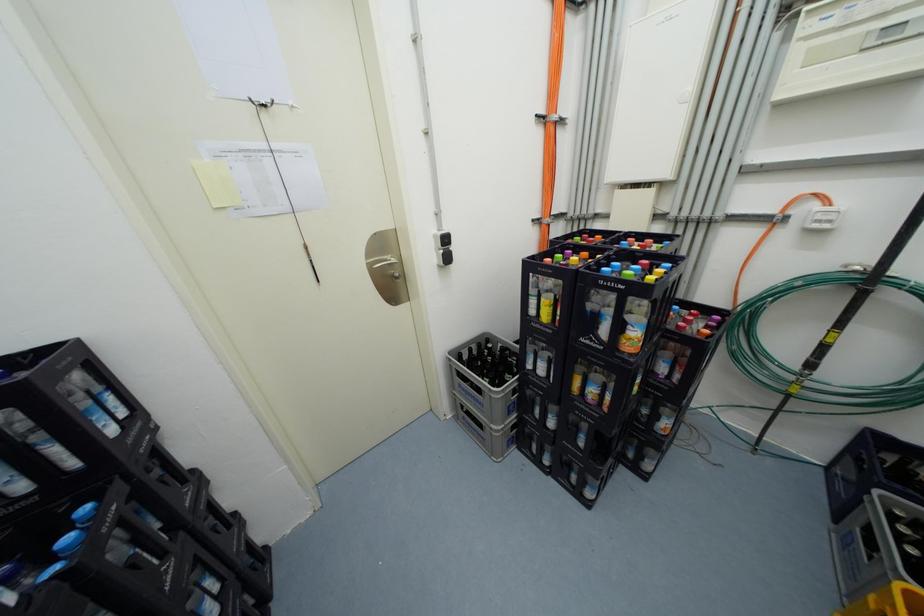
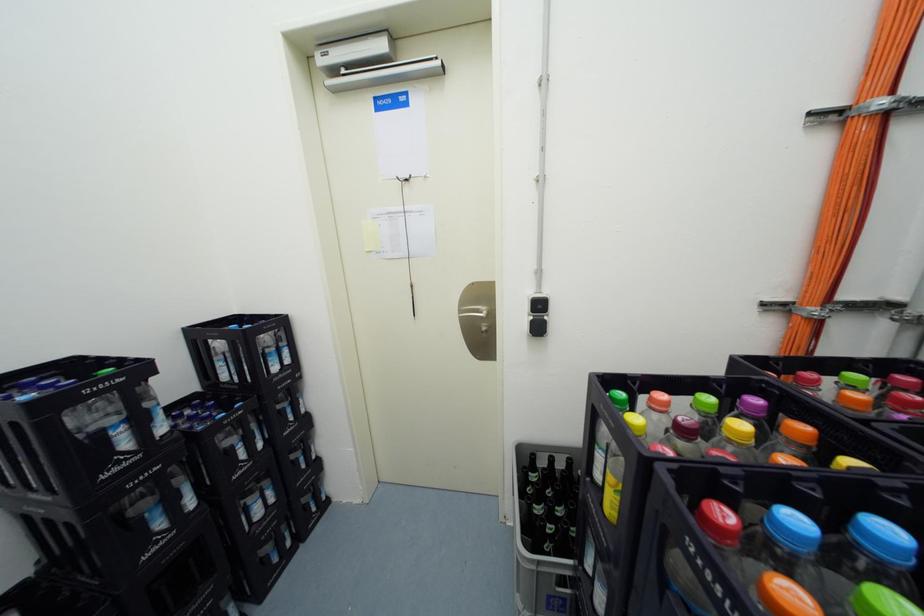
Question: Based on the continuous images, in which direction is the camera rotating? Reply with the corresponding letter.

Choices:
 (A) Left
 (B) Right
 (C) Up
 (D) Down

Answer: (A)